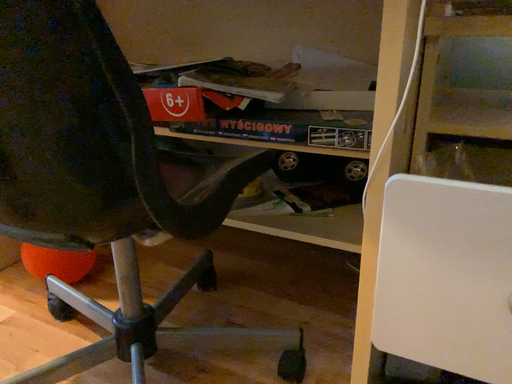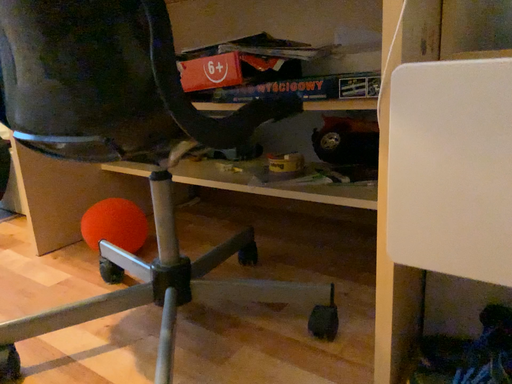
Question: How did the camera likely rotate when shooting the video?

Choices:
 (A) rotated left
 (B) rotated right

Answer: (A)